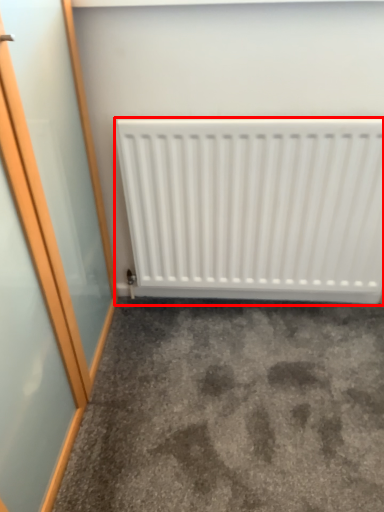
Question: From the image's perspective, where is radiator (annotated by the red box) located relative to concrete?

Choices:
 (A) below
 (B) above

Answer: (B)